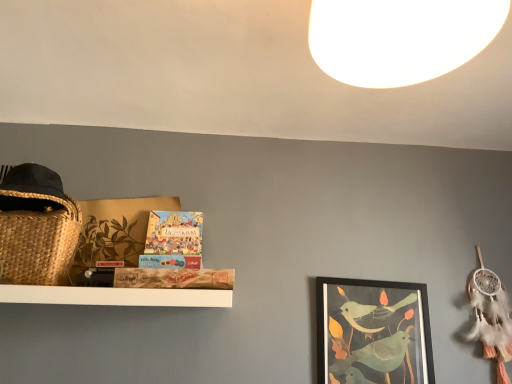
Question: Is white matte light at upper center wider than matte black picture frame at center right?

Choices:
 (A) yes
 (B) no

Answer: (A)

Question: Is white matte light at upper center in front of matte black picture frame at center right?

Choices:
 (A) yes
 (B) no

Answer: (A)

Question: Considering the relative sizes of white matte light at upper center and matte black picture frame at center right in the image provided, is white matte light at upper center taller than matte black picture frame at center right?

Choices:
 (A) yes
 (B) no

Answer: (B)

Question: Would you say white matte light at upper center is outside matte black picture frame at center right?

Choices:
 (A) yes
 (B) no

Answer: (A)

Question: Can you see white matte light at upper center touching matte black picture frame at center right?

Choices:
 (A) no
 (B) yes

Answer: (A)

Question: Is white matte light at upper center to the right of matte black picture frame at center right from the viewer's perspective?

Choices:
 (A) yes
 (B) no

Answer: (B)

Question: Can you confirm if matte board game at center is positioned to the right of white matte light at upper center?

Choices:
 (A) yes
 (B) no

Answer: (B)

Question: Does matte board game at center have a lesser width compared to white matte light at upper center?

Choices:
 (A) yes
 (B) no

Answer: (A)

Question: Does matte board game at center have a greater width compared to white matte light at upper center?

Choices:
 (A) no
 (B) yes

Answer: (A)

Question: Can white matte light at upper center be found inside matte board game at center?

Choices:
 (A) yes
 (B) no

Answer: (B)

Question: Does matte board game at center appear on the left side of white matte light at upper center?

Choices:
 (A) yes
 (B) no

Answer: (A)

Question: Is matte board game at center oriented away from white matte light at upper center?

Choices:
 (A) no
 (B) yes

Answer: (A)

Question: Considering the relative positions of matte board game at center and matte black picture frame at center right in the image provided, is matte board game at center behind matte black picture frame at center right?

Choices:
 (A) no
 (B) yes

Answer: (A)